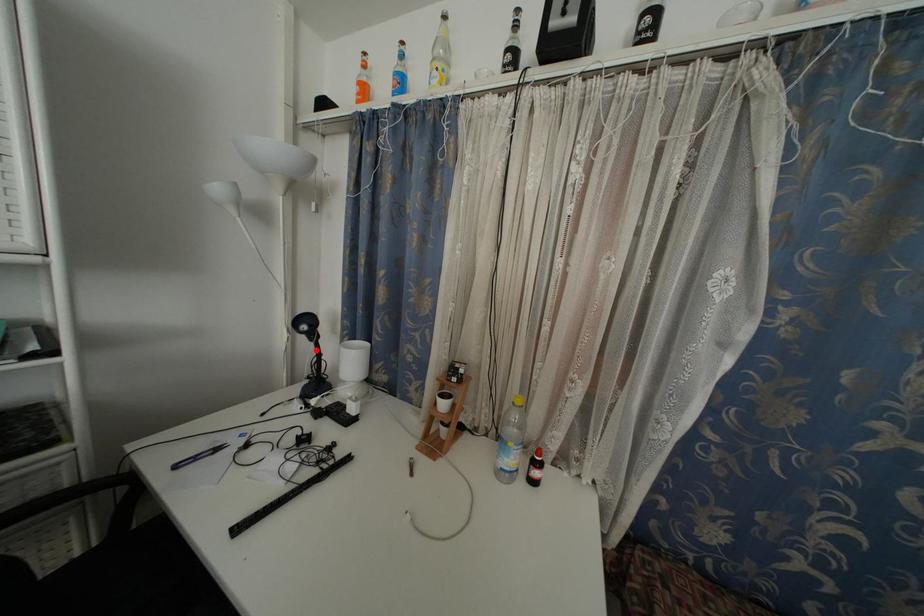
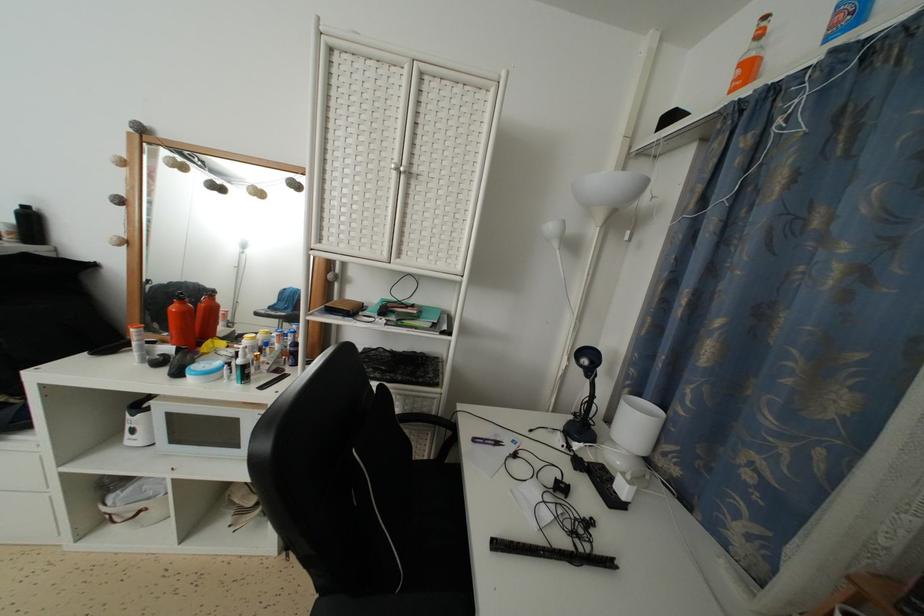
Find the pixel in the second image that matches the highlighted location in the first image.

(591, 387)